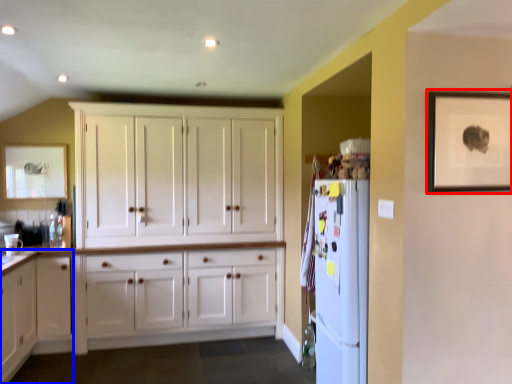
Question: Which of the following is the farthest to the observer, picture frame (highlighted by a red box) or dresser (highlighted by a blue box)?

Choices:
 (A) picture frame
 (B) dresser

Answer: (B)